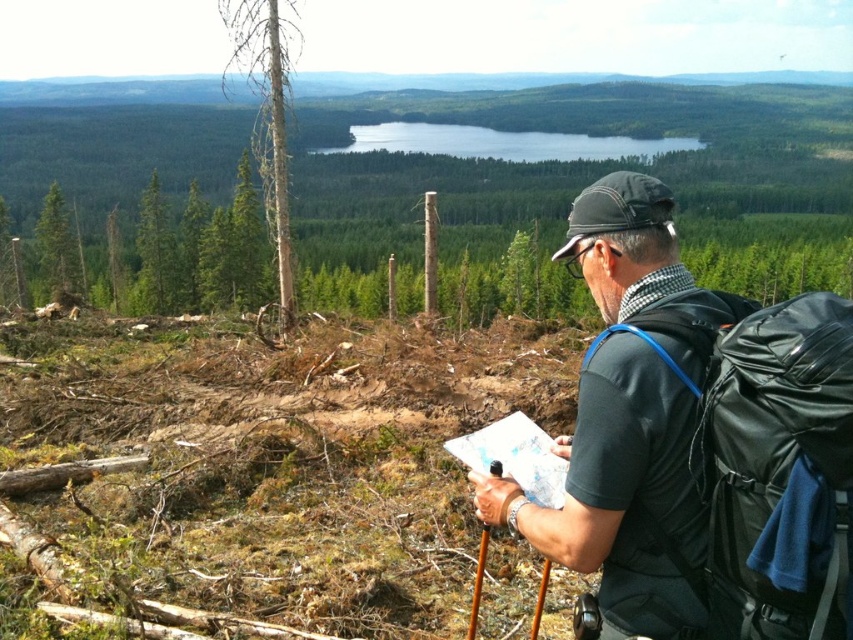
You are a hiker trying to navigate using the trees in the image. Which tree, the white smooth tree at upper left or the green rough bark tree at left, is positioned higher up in the image?

The white smooth tree at upper left is positioned higher up in the image than the green rough bark tree at left.

You are the hiker standing on the hilltop. You notice two points in the distance. The first point is at coordinates point (165,250) and the second is at point (155,253). Which point is closer to you?

Point (155,253) is closer to you because it is less further to the camera than point (165,250).